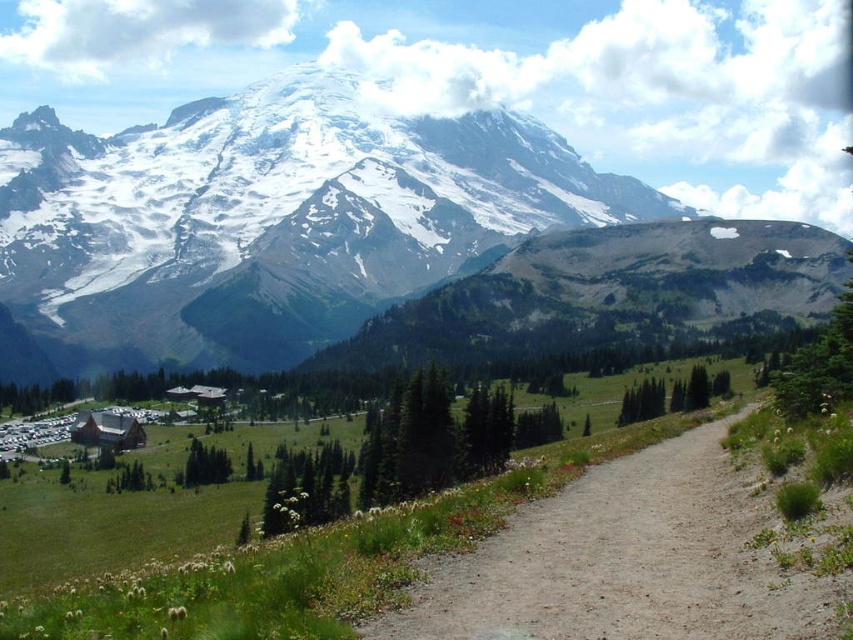
Question: Is snowy granite mountain range at upper center above dirt/gravel path at center?

Choices:
 (A) no
 (B) yes

Answer: (B)

Question: Does snowy granite mountain range at upper center lie in front of dirt/gravel path at center?

Choices:
 (A) no
 (B) yes

Answer: (A)

Question: Which point is closer to the camera taking this photo?

Choices:
 (A) (733, 544)
 (B) (193, 256)

Answer: (A)

Question: Where is snowy granite mountain range at upper center located in relation to dirt/gravel path at center in the image?

Choices:
 (A) left
 (B) right

Answer: (A)

Question: Among these objects, which one is nearest to the camera?

Choices:
 (A) dirt/gravel path at center
 (B) snowy granite mountain range at upper center

Answer: (A)

Question: Among these objects, which one is farthest from the camera?

Choices:
 (A) snowy granite mountain range at upper center
 (B) dirt/gravel path at center

Answer: (A)